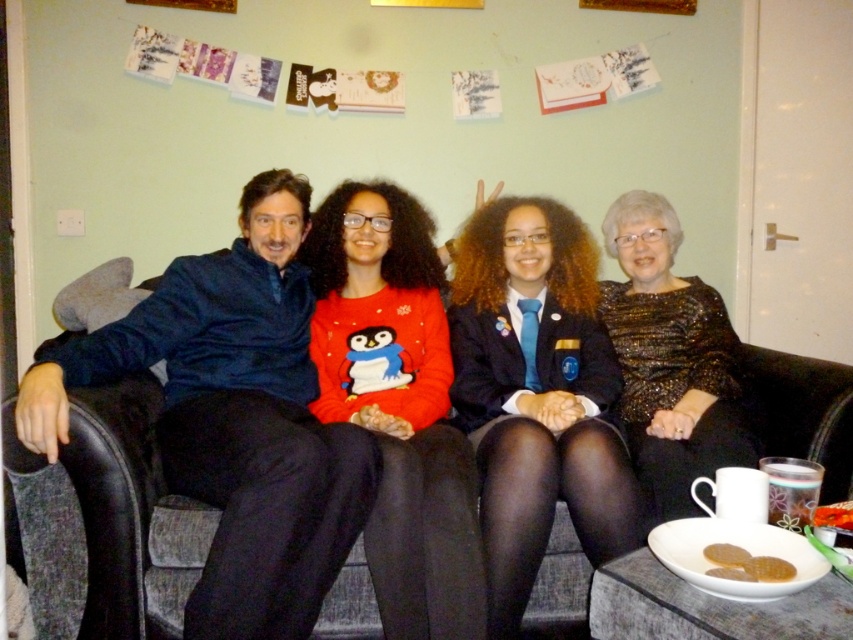
You are a photographer setting up for a group photo. You need to ensure that the blue fleece jacket at left and the sparkly gold dress at center are both visible in the frame. Given their height difference, which object might block the view of the other if positioned improperly?

The blue fleece jacket at left is taller than the sparkly gold dress at center. If positioned directly in front of the dress, the jacket could block the view of the dress.

You are standing in front of the sofa where the four individuals are seated. You notice two points marked on the wall behind them. One is at coordinate point (827, 432) and the other at point (527, 595). Which point is closer to you?

Point (827, 432) is further to the camera than point (527, 595), so the point closer to you is point (527, 595).

You are standing in front of the sofa and want to hand a gift to the person wearing the sparkly gold dress at center without disturbing the person in the blue fleece jacket at left. Can you do this?

The blue fleece jacket at left is below the sparkly gold dress at center, so the sparkly gold dress at center is higher up. Since the jacket is below, the person wearing the sparkly gold dress at center is likely seated behind or above the person in the blue fleece jacket at left. You can approach from the side opposite the jacket wearer to hand the gift without disturbing them.